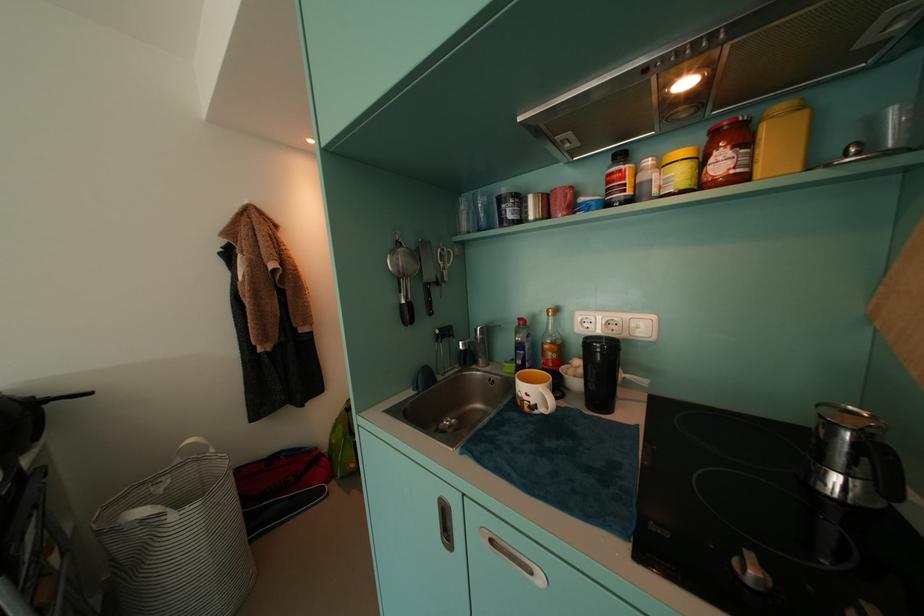
This screenshot has width=924, height=616. Identify the location of red soap dispenser. (475, 347).